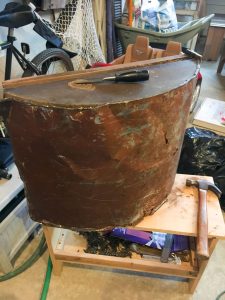
The height and width of the screenshot is (300, 225). What are the coordinates of `handle` in the screenshot? It's located at (146, 73).